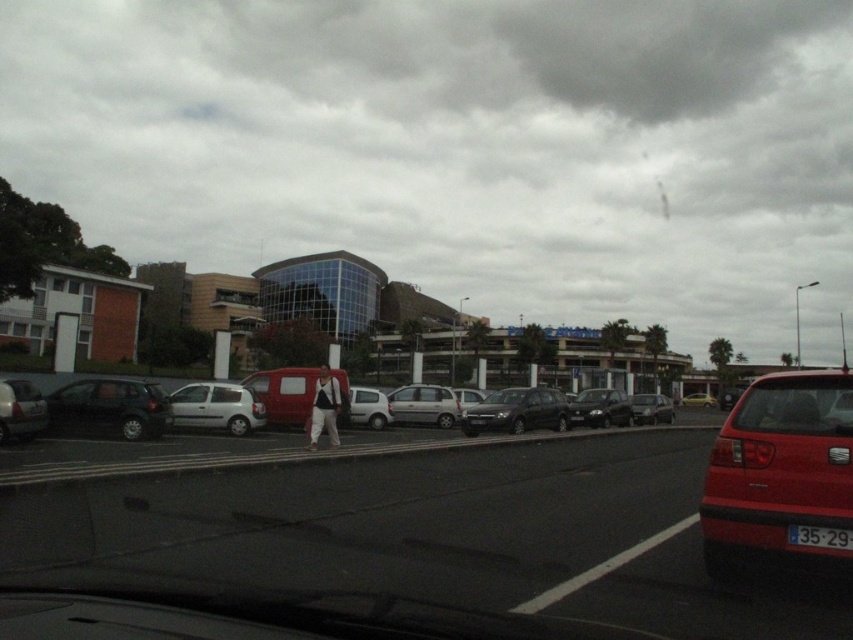
Who is lower down, white matte hatchback at center or gold metallic car at center?

Positioned lower is gold metallic car at center.

Does point (369, 420) come farther from viewer compared to point (693, 403)?

No.

Identify the location of white matte hatchback at center. The image size is (853, 640). (368, 406).

Can you confirm if silver metallic hatchback at left is thinner than shiny black sedan at center?

Yes.

Between silver metallic hatchback at left and shiny black sedan at center, which one has less height?

silver metallic hatchback at left

You are a GUI agent. You are given a task and a screenshot of the screen. Output one action in this format:
    pyautogui.click(x=<x>, y=<y>)
    Task: Click on the silver metallic hatchback at left
    
    Given the screenshot: What is the action you would take?
    pyautogui.click(x=20, y=410)

Does point (50, 426) lie behind point (352, 422)?

No, it is not.

Find the location of a particular element. matte black suv at left is located at coordinates (108, 408).

Between point (59, 424) and point (374, 400), which one is positioned behind?

Point (374, 400)

Identify the location of matte black suv at left. (108, 408).